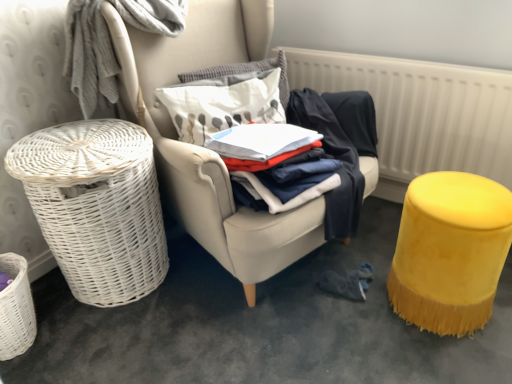
The height and width of the screenshot is (384, 512). What are the coordinates of `free space in front of yellow velvet stool at right` in the screenshot? It's located at (447, 354).